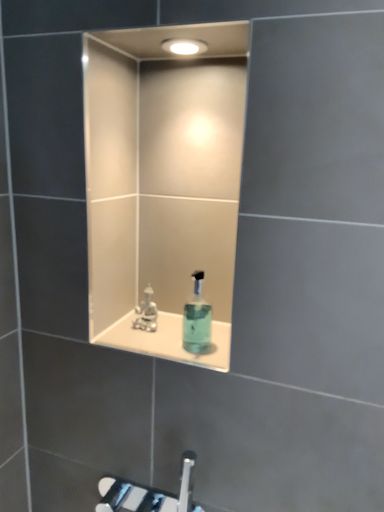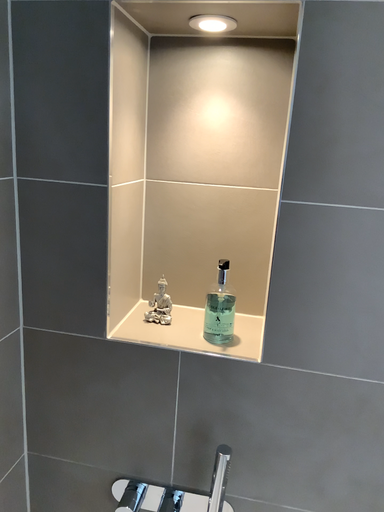
Question: How did the camera likely rotate when shooting the video?

Choices:
 (A) rotated right
 (B) rotated left

Answer: (A)